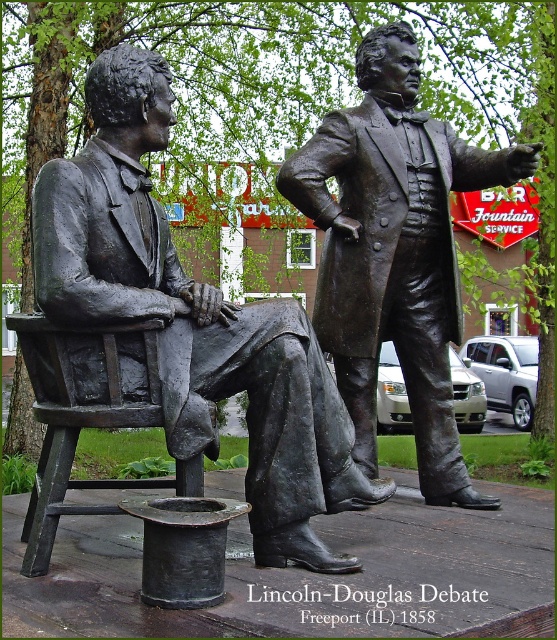
Is bronze statue at center shorter than bronze wooden chair at left?

In fact, bronze statue at center may be taller than bronze wooden chair at left.

Is bronze statue at center to the left of bronze wooden chair at left from the viewer's perspective?

No, bronze statue at center is not to the left of bronze wooden chair at left.

Locate an element on the screen. This screenshot has height=640, width=557. bronze statue at center is located at coordinates (394, 252).

Between bronze statue of man sitting at left and bronze wooden chair at left, which one appears on the left side from the viewer's perspective?

Positioned to the left is bronze wooden chair at left.

Measure the distance between point (35, 296) and camera.

They are 6.80 meters apart.

What do you see at coordinates (193, 320) in the screenshot? I see `bronze statue of man sitting at left` at bounding box center [193, 320].

What are the coordinates of `bronze statue of man sitting at left` in the screenshot? It's located at (193, 320).

Between bronze statue of man sitting at left and bronze statue at center, which one is positioned lower?

bronze statue of man sitting at left

Does point (267, 492) come closer to viewer compared to point (411, 220)?

Yes, it is in front of point (411, 220).

What do you see at coordinates (193, 320) in the screenshot? The image size is (557, 640). I see `bronze statue of man sitting at left` at bounding box center [193, 320].

Locate an element on the screen. The image size is (557, 640). bronze statue of man sitting at left is located at coordinates (193, 320).